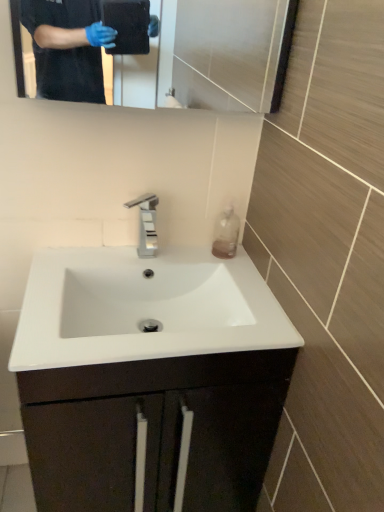
You are a GUI agent. You are given a task and a screenshot of the screen. Output one action in this format:
    pyautogui.click(x=<x>, y=<y>)
    Task: Click on the empty space that is ontop of white glossy sink at center (from a real-world perspective)
    This screenshot has height=512, width=384.
    Given the screenshot: What is the action you would take?
    pyautogui.click(x=150, y=263)